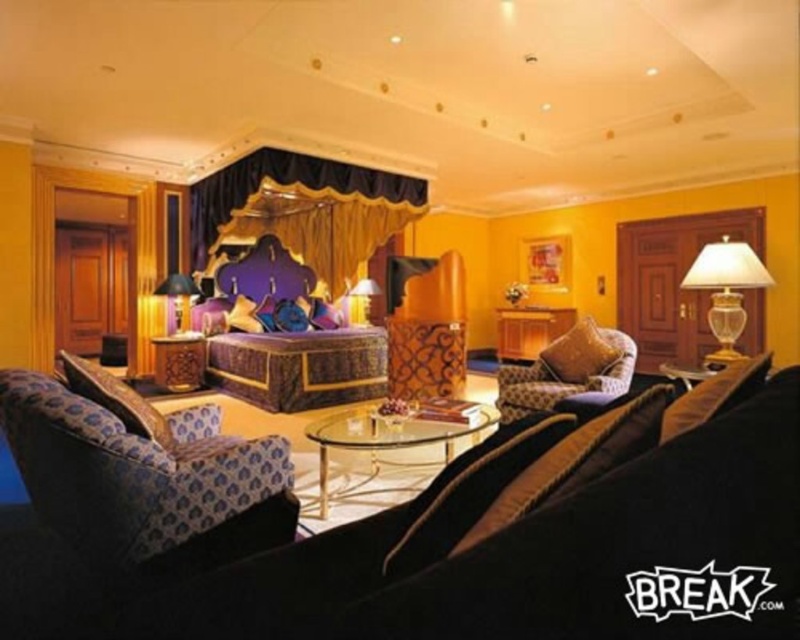
Can you confirm if velvet dark brown couch at lower center is positioned above transparent glass coffee table at center?

Correct, velvet dark brown couch at lower center is located above transparent glass coffee table at center.

I want to click on velvet dark brown couch at lower center, so click(x=416, y=536).

Which is in front, point (460, 612) or point (326, 509)?

Point (460, 612)

The width and height of the screenshot is (800, 640). Identify the location of velvet dark brown couch at lower center. (416, 536).

Locate an element on the screen. The height and width of the screenshot is (640, 800). patterned fabric armchair at center is located at coordinates (568, 371).

Can you confirm if patterned fabric armchair at center is taller than matte gold lamp at center?

Correct, patterned fabric armchair at center is much taller as matte gold lamp at center.

Identify the location of patterned fabric armchair at center. (568, 371).

Who is lower down, gold textured pillow at center or matte gold lamp at center?

Positioned lower is gold textured pillow at center.

Is gold textured pillow at center shorter than matte gold lamp at center?

Correct, gold textured pillow at center is not as tall as matte gold lamp at center.

This screenshot has width=800, height=640. Find the location of `gold textured pillow at center`. gold textured pillow at center is located at coordinates click(580, 353).